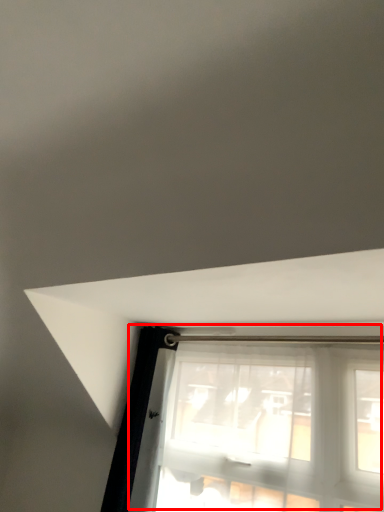
Question: Observing the image, what is the correct spatial positioning of window (annotated by the red box) in reference to beam?

Choices:
 (A) left
 (B) right

Answer: (B)